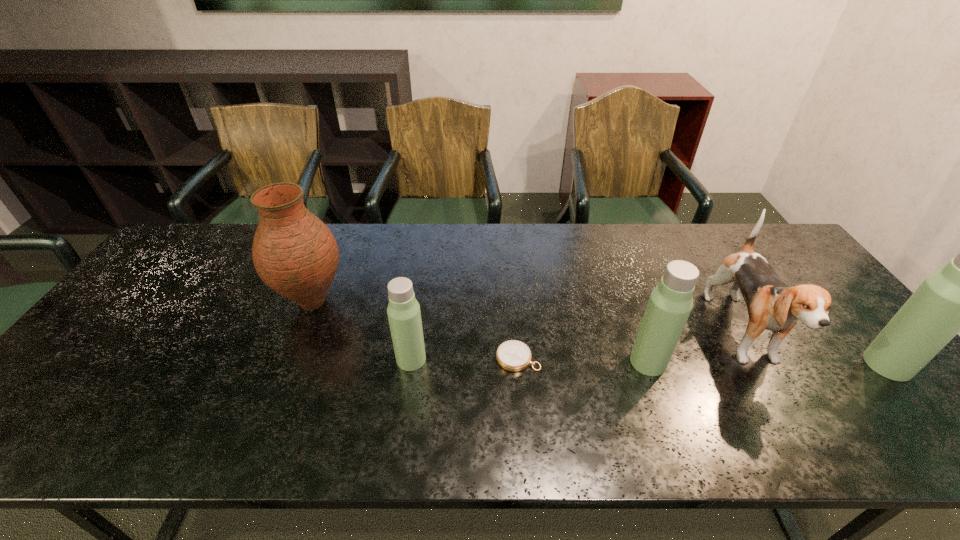
Where is `the shortest thermos bottle`? the shortest thermos bottle is located at coordinates (403, 310).

Locate an element on the screen. The width and height of the screenshot is (960, 540). the second shortest object is located at coordinates (403, 310).

Where is `the fourth object from left to right`? This screenshot has width=960, height=540. the fourth object from left to right is located at coordinates (671, 301).

You are a GUI agent. You are given a task and a screenshot of the screen. Output one action in this format:
    pyautogui.click(x=<x>, y=<y>)
    Task: Click on the second tallest thermos bottle
    The width and height of the screenshot is (960, 540).
    Given the screenshot: What is the action you would take?
    pyautogui.click(x=671, y=301)

The width and height of the screenshot is (960, 540). Identify the location of the rightmost thermos bottle. (959, 297).

You are a GUI agent. You are given a task and a screenshot of the screen. Output one action in this format:
    pyautogui.click(x=<x>, y=<y>)
    Task: Click on the leftmost object
    The image size is (960, 540).
    Given the screenshot: What is the action you would take?
    pyautogui.click(x=294, y=253)

Locate an element on the screen. the second object from right to left is located at coordinates (772, 305).

The image size is (960, 540). I want to click on the shortest object, so click(513, 355).

You are a GUI agent. You are given a task and a screenshot of the screen. Output one action in this format:
    pyautogui.click(x=<x>, y=<y>)
    Task: Click on the fourth object from right to left
    Image resolution: width=960 pixels, height=540 pixels.
    Given the screenshot: What is the action you would take?
    tap(513, 355)

At what (x,y) coordinates should I click in order to perform the action: click on vacant space situated 0.310m on the right of the shortest thermos bottle. Please return your answer as a coordinate pair (x, y). This screenshot has height=540, width=960. Looking at the image, I should click on (550, 359).